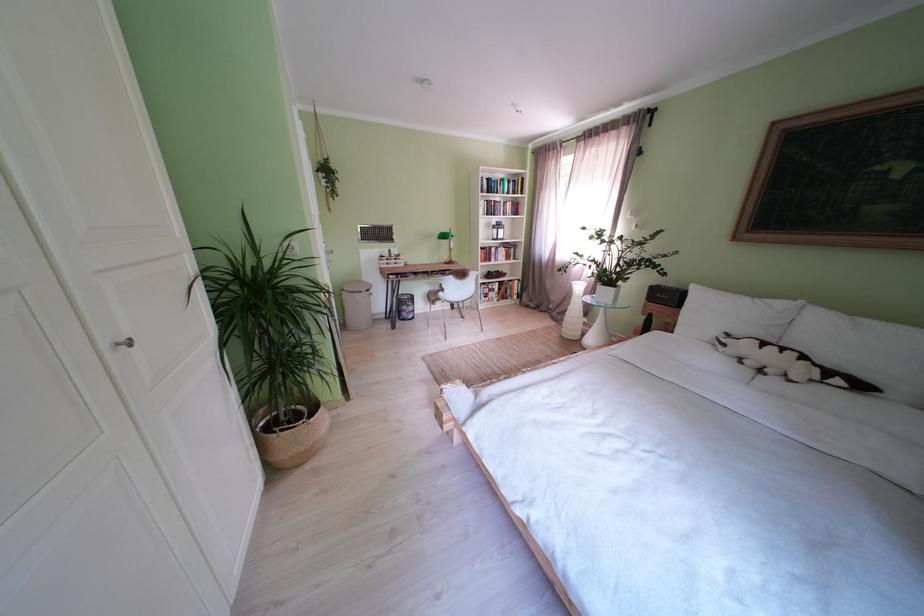
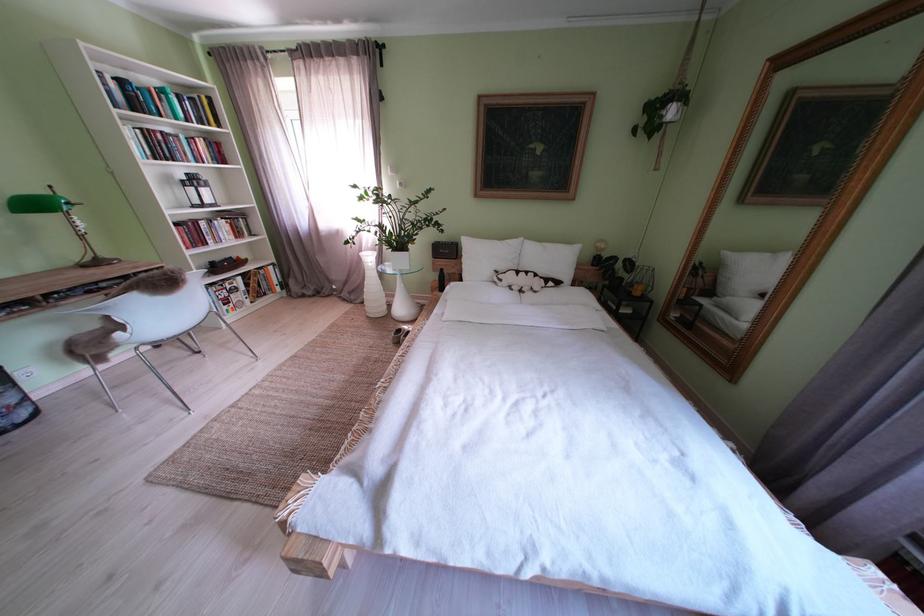
In the second image, find the point that corresponds to the point at 456,241 in the first image.

(46, 209)